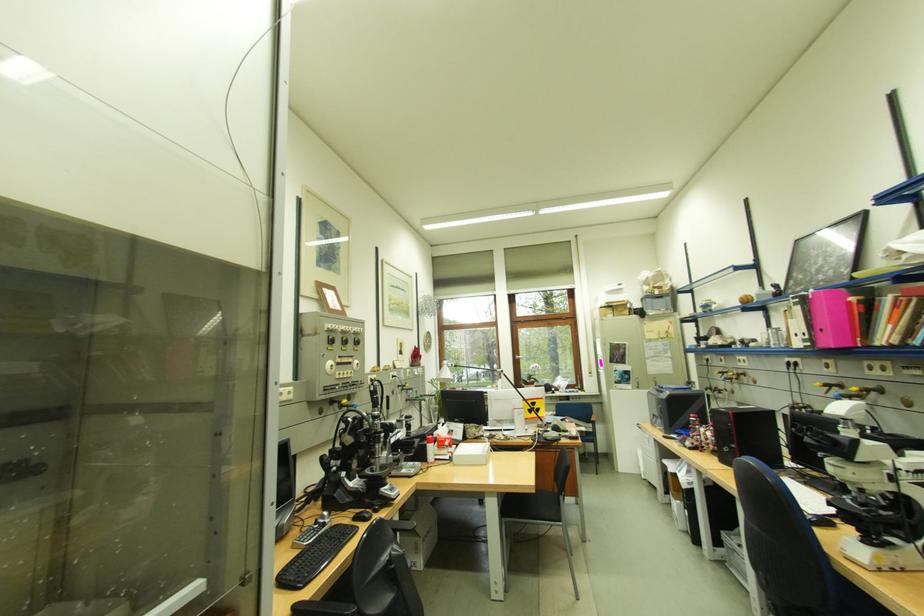
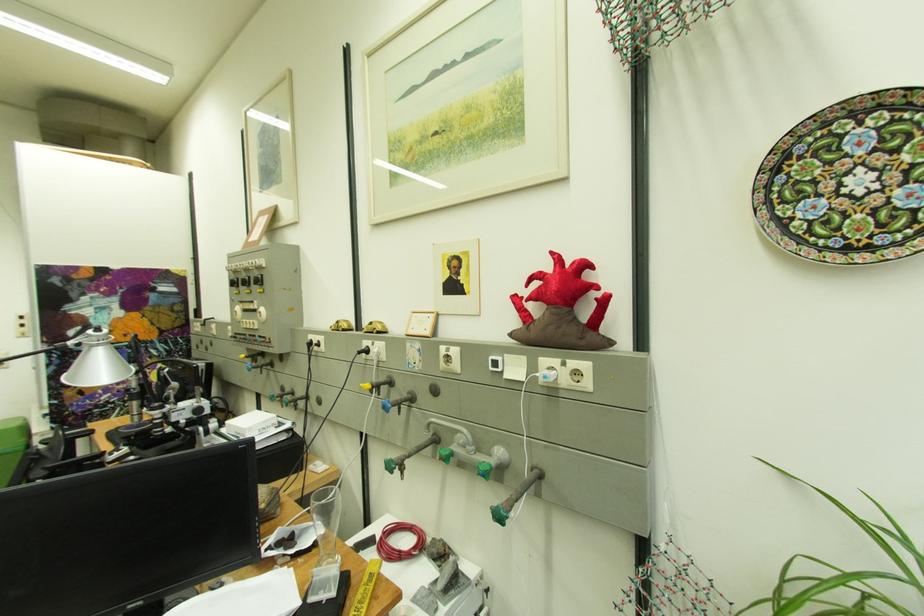
Where in the second image is the point corresponding to the point at 402,374 from the first image?

(375, 344)